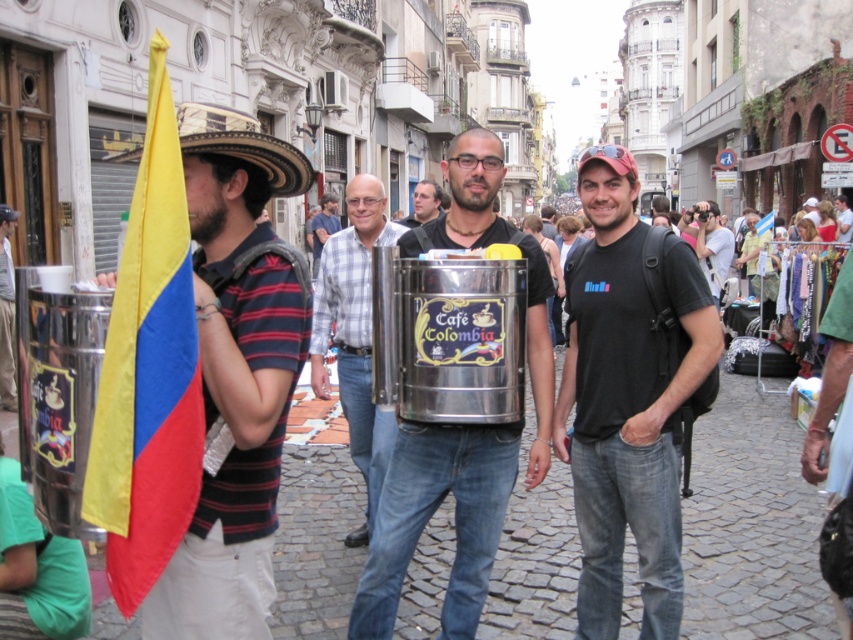
You are standing in the street scene and want to walk towards the two points marked in the image. Which point, point [0,348] or point [434,198], will you reach first?

Point [0,348] is closer to the viewer than point [434,198], so you will reach point [0,348] first.